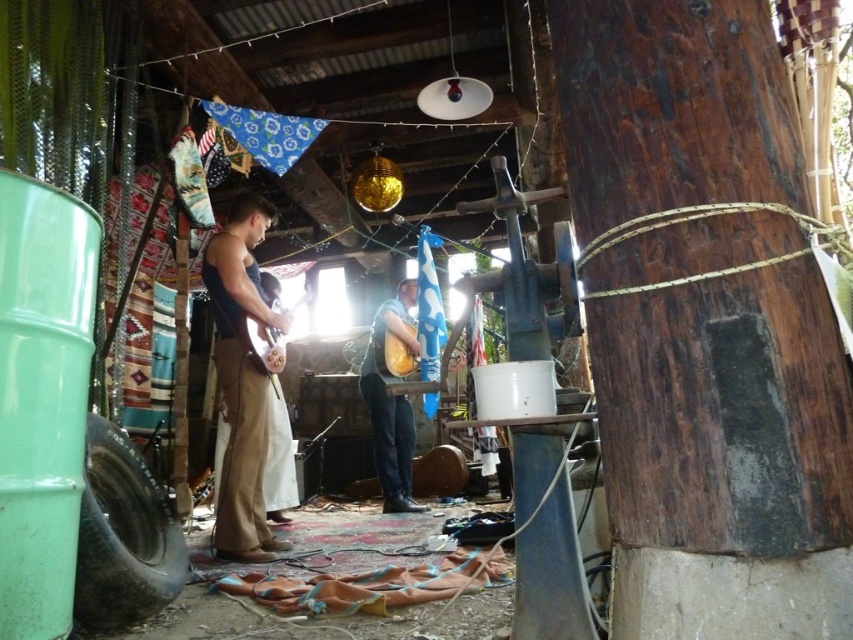
You are a musician who needs to choose between the brown suede guitar at center and the matte brown guitar at center based on their sizes. Which guitar is thinner?

The brown suede guitar at center is thinner than the matte brown guitar at center.

You are a music enthusiast who wants to place both the brown suede guitar at center and the matte brown guitar at center on a shelf. The shelf has a height limit of 1 meter. Can both guitars fit vertically on the shelf without exceeding the height limit?

The brown suede guitar at center is much taller than the matte brown guitar at center. Since the shelf has a height limit of 1 meter, only the shorter matte brown guitar at center can fit vertically. The taller brown suede guitar at center would exceed the shelf height limit.

You are a photographer setting up for a music session. You need to capture both the brown suede guitar at center and the matte brown guitar at center clearly in your shot. However, the camera can only focus on one layer at a time. Which guitar should you adjust the focus to first to ensure it appears sharp in the final image?

The brown suede guitar at center is positioned over the matte brown guitar at center, so you should focus on the brown suede guitar at center first to ensure it appears sharp.